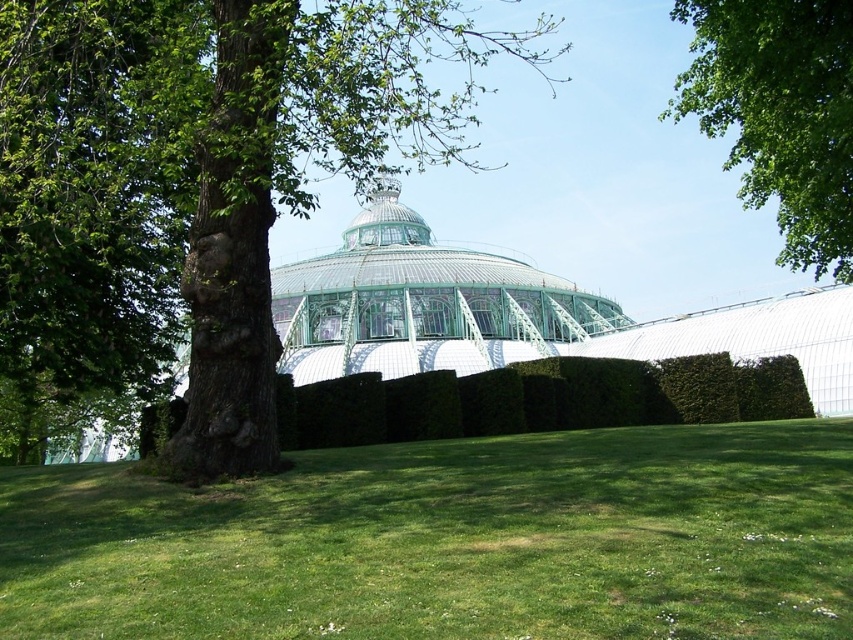
Who is shorter, green grass at center or green rough bark tree at left?

green grass at center

Who is more forward, [317,490] or [259,458]?

Point [317,490]

The width and height of the screenshot is (853, 640). Identify the location of green grass at center. (450, 540).

In the scene shown: Is green leafy tree at upper right wider than green glass dome at center?

In fact, green leafy tree at upper right might be narrower than green glass dome at center.

Between point (833, 134) and point (552, 308), which one is positioned in front?

Positioned in front is point (833, 134).

Identify the location of green leafy tree at upper right. The height and width of the screenshot is (640, 853). (779, 113).

Based on the photo, which is more to the right, green grass at center or green glass dome at center?

Positioned to the right is green glass dome at center.

Which is in front, point (219, 580) or point (537, 272)?

Point (219, 580)

Where is `green grass at center`? The image size is (853, 640). green grass at center is located at coordinates (450, 540).